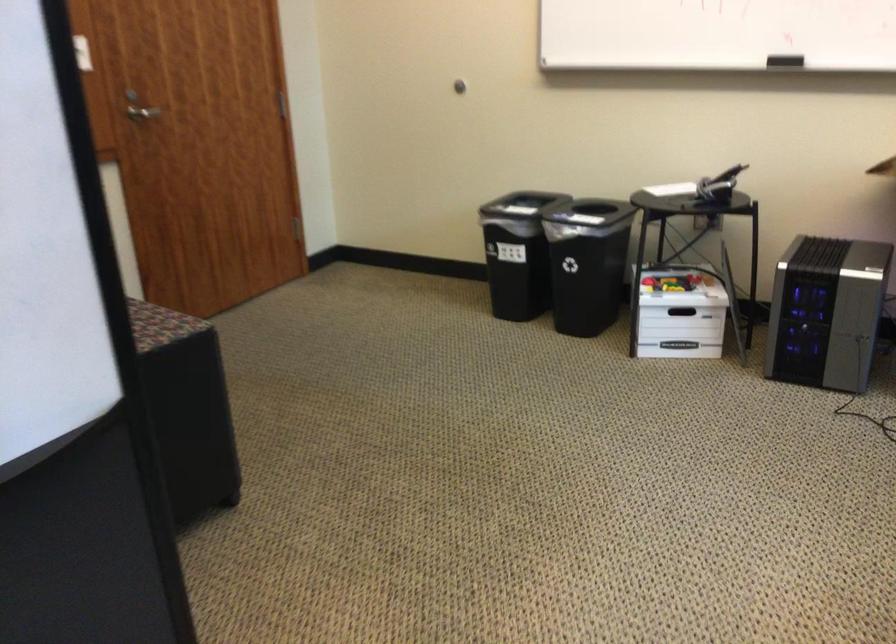
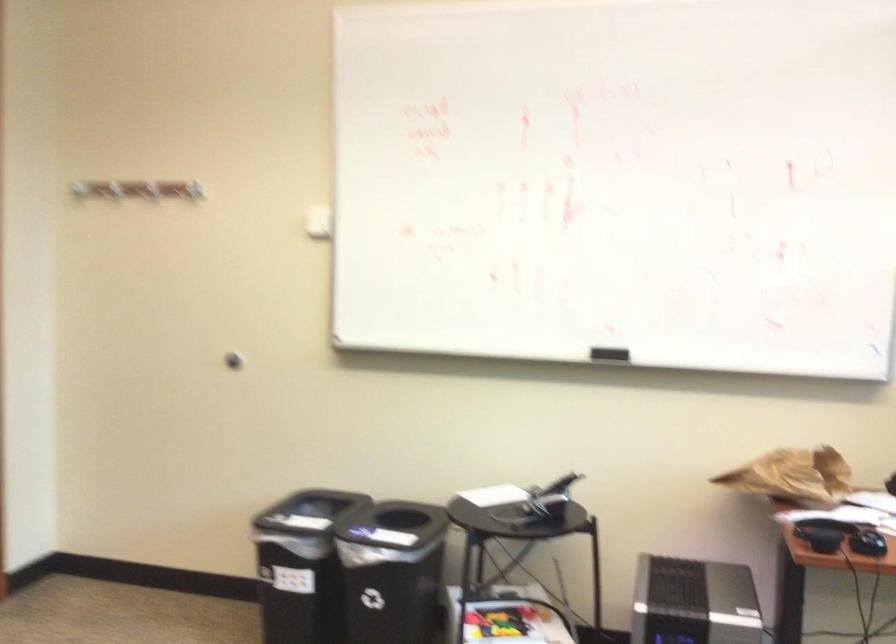
Locate, in the second image, the point that corresponds to the point at 703,189 in the first image.

(539, 503)